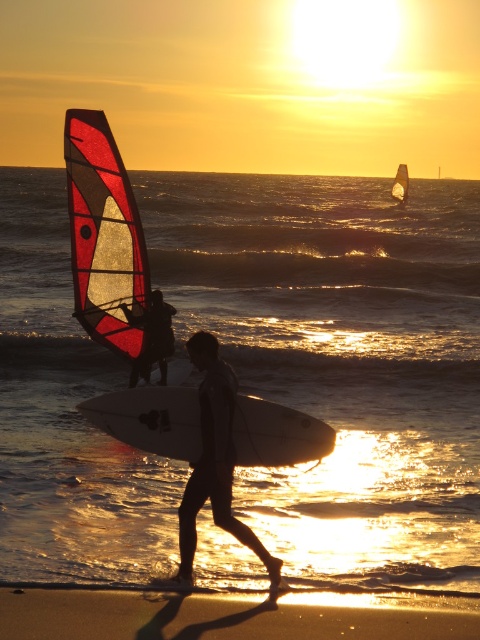
Question: Which point appears farthest from the camera in this image?

Choices:
 (A) (273, 316)
 (B) (165, 365)
 (C) (132, 253)
 (D) (268, 458)

Answer: (A)

Question: Can you confirm if sandy shore at lower left is positioned to the left of black wetsuit at center?

Choices:
 (A) no
 (B) yes

Answer: (A)

Question: Which object is farther from the camera taking this photo?

Choices:
 (A) sandy shore at lower left
 (B) silhouette wetsuit at center
 (C) white matte surfboard at center

Answer: (B)

Question: Is white matte surfboard at center positioned behind black wetsuit at center?

Choices:
 (A) no
 (B) yes

Answer: (B)

Question: Is sandy shore at lower left to the right of black wetsuit at center from the viewer's perspective?

Choices:
 (A) no
 (B) yes

Answer: (B)

Question: Which of these objects is positioned farthest from the translucent plastic water at center?

Choices:
 (A) sandy shore at lower left
 (B) translucent red sail at left
 (C) white glossy sail at upper right
 (D) white matte surfboard at center

Answer: (D)